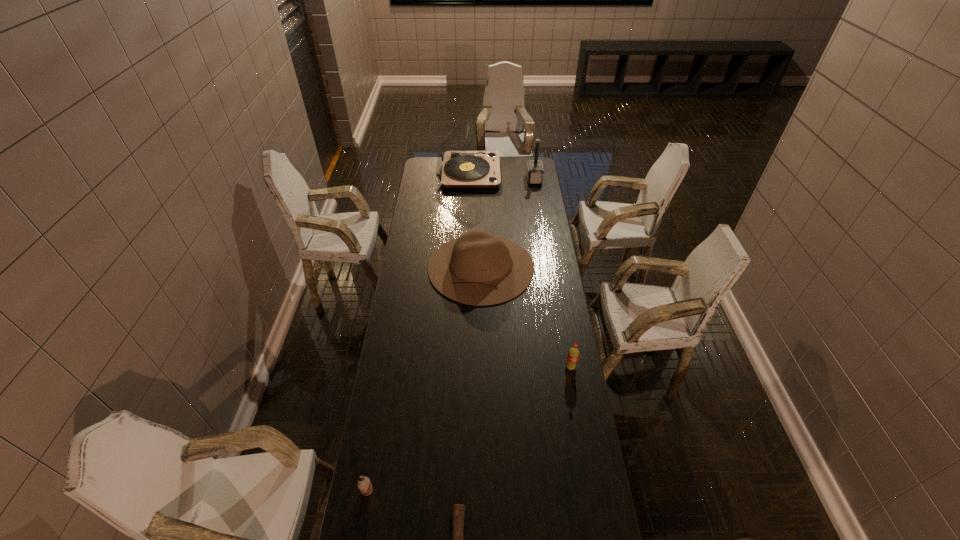
What are the coordinates of `chocolate milk at the left edge` in the screenshot? It's located at (364, 484).

This screenshot has width=960, height=540. Find the location of `hammer positioned at the right edge`. hammer positioned at the right edge is located at coordinates (534, 170).

You are a GUI agent. You are given a task and a screenshot of the screen. Output one action in this format:
    pyautogui.click(x=<x>, y=<y>)
    Task: Click on the sombrero that is at the right edge
    
    Given the screenshot: What is the action you would take?
    pyautogui.click(x=478, y=268)

This screenshot has height=540, width=960. Find the location of `soda that is positioned at the right edge`. soda that is positioned at the right edge is located at coordinates (573, 354).

What are the coordinates of `object located at the far left corner` in the screenshot? It's located at (456, 168).

Where is `object located in the far right corner section of the desktop`? object located in the far right corner section of the desktop is located at coordinates (534, 170).

In the image, there is a desktop. What are the coordinates of `vacant space at the left edge` in the screenshot? It's located at tap(395, 338).

Where is `vacant space at the right edge`? vacant space at the right edge is located at coordinates (572, 420).

In order to click on vacant space at the far left corner in this screenshot , I will do tap(425, 163).

Locate an element on the screen. The image size is (960, 540). unoccupied area between the second tallest object and the tallest object is located at coordinates (501, 176).